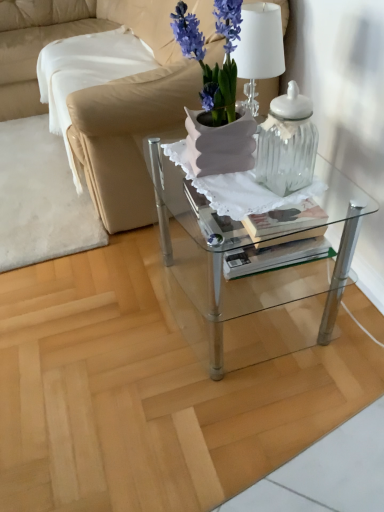
Question: Does beige leather couch at upper left have a greater width compared to purple matte vase at center?

Choices:
 (A) yes
 (B) no

Answer: (A)

Question: From a real-world perspective, does beige leather couch at upper left stand above purple matte vase at center?

Choices:
 (A) yes
 (B) no

Answer: (B)

Question: Considering the relative sizes of beige leather couch at upper left and purple matte vase at center in the image provided, is beige leather couch at upper left shorter than purple matte vase at center?

Choices:
 (A) no
 (B) yes

Answer: (A)

Question: From the image's perspective, is beige leather couch at upper left located above purple matte vase at center?

Choices:
 (A) yes
 (B) no

Answer: (A)

Question: Is beige leather couch at upper left to the left of purple matte vase at center from the viewer's perspective?

Choices:
 (A) yes
 (B) no

Answer: (A)

Question: From the image's perspective, is purple matte vase at center above or below clear glass table at center?

Choices:
 (A) above
 (B) below

Answer: (A)

Question: From their relative heights in the image, would you say purple matte vase at center is taller or shorter than clear glass table at center?

Choices:
 (A) tall
 (B) short

Answer: (B)

Question: Is purple matte vase at center wider or thinner than clear glass table at center?

Choices:
 (A) thin
 (B) wide

Answer: (A)

Question: Is purple matte vase at center situated inside clear glass table at center or outside?

Choices:
 (A) outside
 (B) inside

Answer: (A)

Question: In the image, is purple matte vase at center on the left side or the right side of clear glass jar at center?

Choices:
 (A) right
 (B) left

Answer: (B)

Question: Relative to clear glass jar at center, is purple matte vase at center in front or behind?

Choices:
 (A) front
 (B) behind

Answer: (A)

Question: Looking at the image, does purple matte vase at center seem bigger or smaller compared to clear glass jar at center?

Choices:
 (A) big
 (B) small

Answer: (A)

Question: From their relative heights in the image, would you say purple matte vase at center is taller or shorter than clear glass jar at center?

Choices:
 (A) short
 (B) tall

Answer: (B)

Question: Based on their sizes in the image, would you say clear glass table at center is bigger or smaller than purple matte vase at center?

Choices:
 (A) small
 (B) big

Answer: (B)

Question: In the image, is clear glass table at center positioned in front of or behind purple matte vase at center?

Choices:
 (A) behind
 (B) front

Answer: (A)